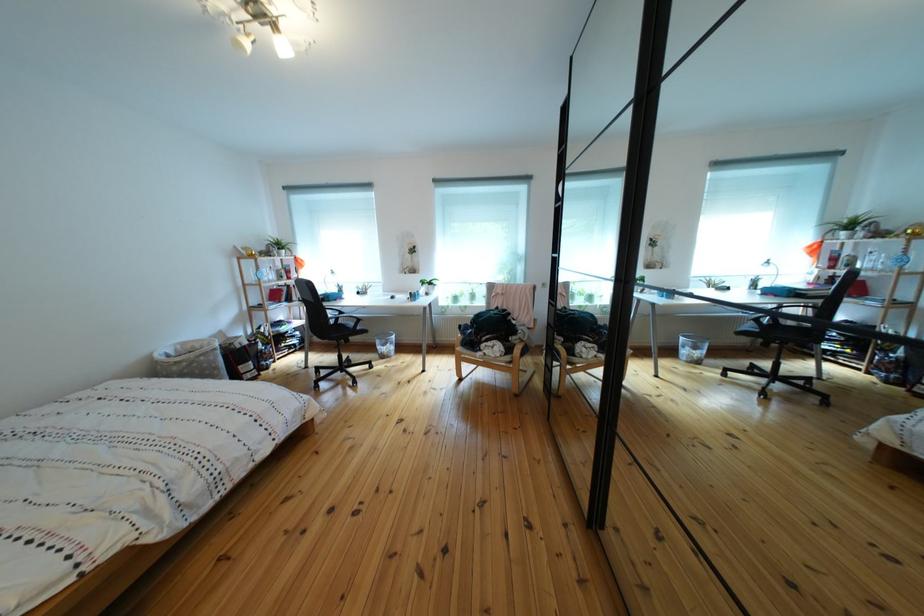
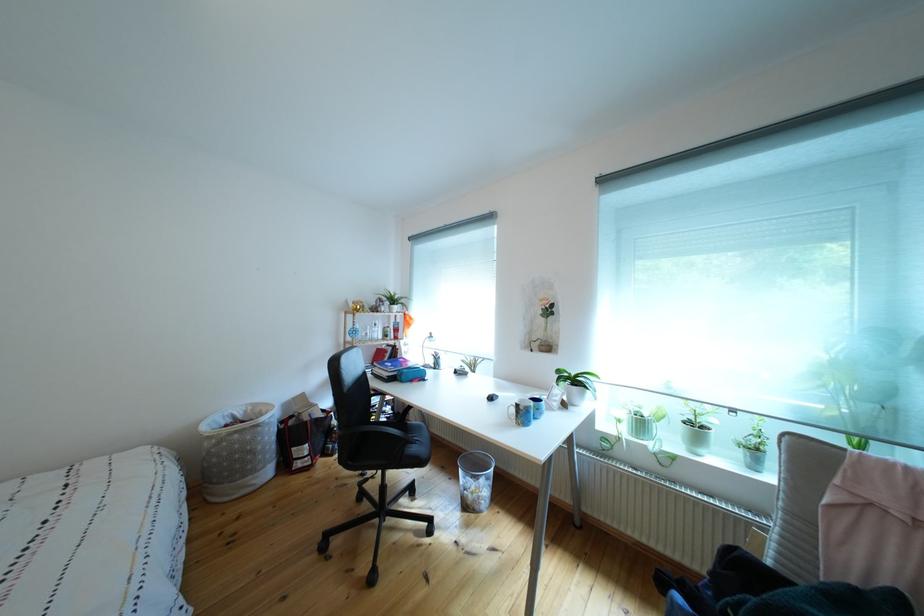
The point at (x=227, y=374) is marked in the first image. Where is the corresponding point in the second image?

(263, 456)